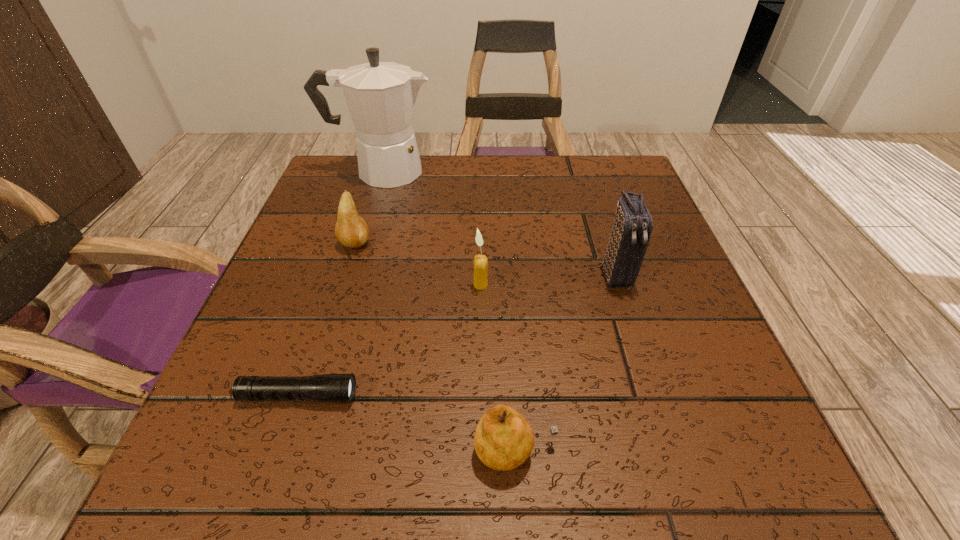
Where is `free area in between the flashlight and the left pear`? The height and width of the screenshot is (540, 960). free area in between the flashlight and the left pear is located at coordinates (327, 320).

You are a GUI agent. You are given a task and a screenshot of the screen. Output one action in this format:
    pyautogui.click(x=<x>, y=<y>)
    Task: Click on the free point between the candle and the shortest object
    
    Given the screenshot: What is the action you would take?
    [390, 340]

The width and height of the screenshot is (960, 540). I want to click on blank region between the clutch bag and the shortest object, so click(457, 335).

Identify the location of unoccupied position between the second tallest object and the nearest object. This screenshot has height=540, width=960. (565, 363).

This screenshot has height=540, width=960. I want to click on free spot between the candle and the nearest object, so click(x=497, y=368).

Locate an element on the screen. The width and height of the screenshot is (960, 540). free space between the farthest object and the shortest object is located at coordinates (340, 284).

Where is `empty space between the clutch bag and the nearest object`? empty space between the clutch bag and the nearest object is located at coordinates pos(565,363).

Find the location of a particular element. The width and height of the screenshot is (960, 540). free point between the rightmost object and the second shortest object is located at coordinates (565, 363).

The height and width of the screenshot is (540, 960). Identify the location of vacant point located between the candle and the nearest object. (497, 368).

Where is `free space between the farthest object and the candle`? The height and width of the screenshot is (540, 960). free space between the farthest object and the candle is located at coordinates point(431,228).